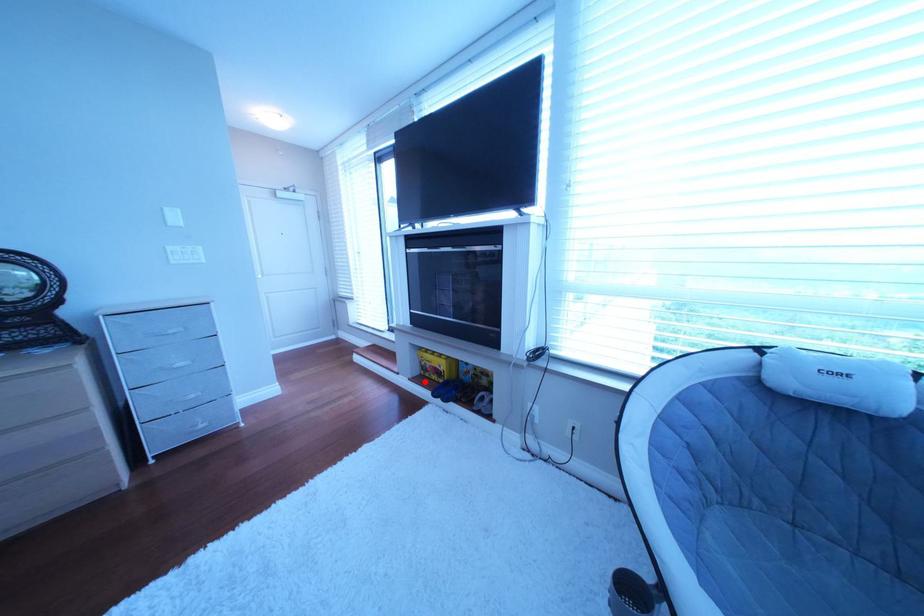
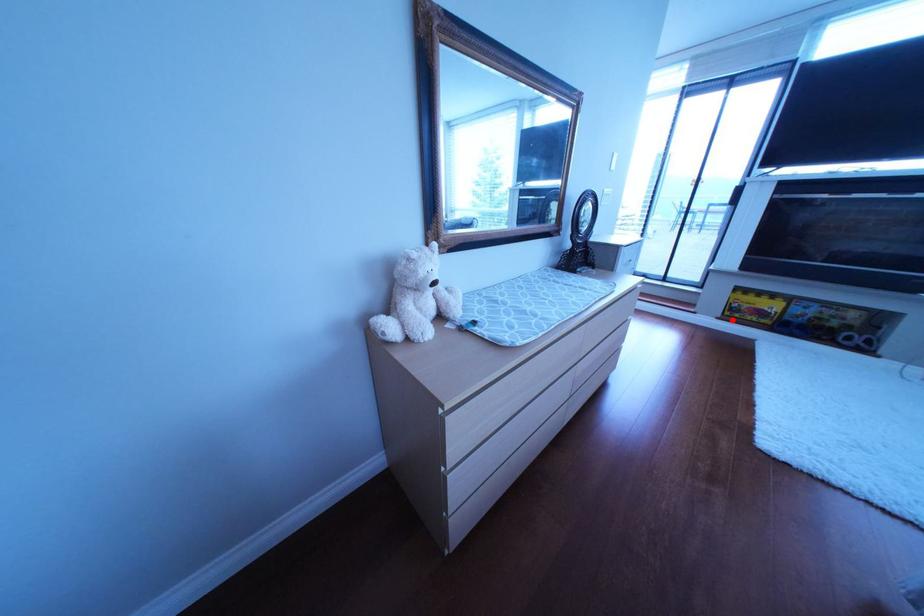
I am providing you with two images of the same scene from different viewpoints. A red point is marked on the first image and another point is marked on the second image. Does the point marked in image1 correspond to the same location as the one in image2?

Yes